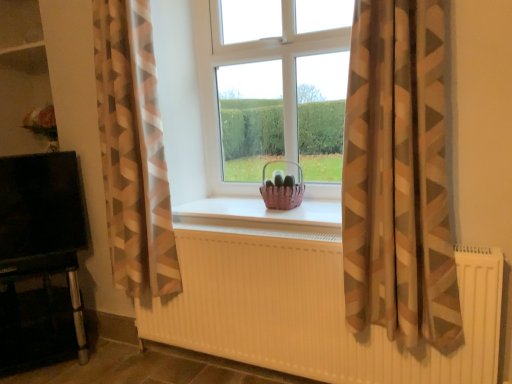
The height and width of the screenshot is (384, 512). Find the location of `white ribbed radiator at center`. white ribbed radiator at center is located at coordinates (310, 310).

At what (x,y) coordinates should I click in order to perform the action: click on black glossy tv at left. Please return your answer as a coordinate pair (x, y). Looking at the image, I should click on point(41,260).

Where is `pink woven basket at center`? Image resolution: width=512 pixels, height=384 pixels. pink woven basket at center is located at coordinates (283, 191).

This screenshot has height=384, width=512. Describe the element at coordinates (263, 211) in the screenshot. I see `pink woven basket at center` at that location.

The image size is (512, 384). Describe the element at coordinates (398, 177) in the screenshot. I see `brown sheer curtain at center, which is the 2th curtain in left-to-right order` at that location.

What is the approximate height of transparent glass window at center?

1.11 meters.

Describe the element at coordinates (273, 89) in the screenshot. Image resolution: width=512 pixels, height=384 pixels. I see `transparent glass window at center` at that location.

This screenshot has width=512, height=384. I want to click on white ribbed radiator at center, so click(310, 310).

In the scene shown: Which is behind, pink woven basket at center or white ribbed radiator at center?

pink woven basket at center is behind.

Image resolution: width=512 pixels, height=384 pixels. In the image, there is a pink woven basket at center. In order to click on radiator below it (from a real-world perspective) in this screenshot , I will do `click(310, 310)`.

Does pink woven basket at center turn towards white ribbed radiator at center?

Yes.

From a real-world perspective, is pink woven basket at center above or below pink woven basket at center?

Clearly, from a real-world perspective, pink woven basket at center is below pink woven basket at center.

Is pink woven basket at center completely or partially outside of pink woven basket at center?

Yes.

Consider the image. Which is less distant, (x=323, y=204) or (x=297, y=163)?

The point (x=323, y=204) is in front.

In the scene shown: Who is more distant, transparent glass window at center or pink woven basket at center?

transparent glass window at center is further from the camera.

From their relative heights in the image, would you say transparent glass window at center is taller or shorter than pink woven basket at center?

In the image, transparent glass window at center appears to be taller than pink woven basket at center.

Is transparent glass window at center to the right of pink woven basket at center from the viewer's perspective?

No, transparent glass window at center is not to the right of pink woven basket at center.

Considering the sizes of pink woven basket at center and transparent glass window at center in the image, is pink woven basket at center taller or shorter than transparent glass window at center?

Clearly, pink woven basket at center is shorter compared to transparent glass window at center.

Which object is further away from the camera taking this photo, pink woven basket at center or transparent glass window at center?

transparent glass window at center is further away from the camera.

From the image's perspective, does pink woven basket at center appear higher than transparent glass window at center?

No.

Does pink woven basket at center have a greater width compared to transparent glass window at center?

Yes, pink woven basket at center is wider than transparent glass window at center.

Considering the sizes of objects beige-patterned curtain at left, placed as the first curtain when sorted from left to right, and white ribbed radiator at center in the image provided, who is wider, beige-patterned curtain at left, placed as the first curtain when sorted from left to right, or white ribbed radiator at center?

beige-patterned curtain at left, placed as the first curtain when sorted from left to right.

From the image's perspective, who appears lower, beige-patterned curtain at left, placed as the first curtain when sorted from left to right, or white ribbed radiator at center?

white ribbed radiator at center appears lower in the image.

Is beige-patterned curtain at left, placed as the first curtain when sorted from left to right, facing towards white ribbed radiator at center?

No.

How much distance is there between beige-patterned curtain at left, placed as the first curtain when sorted from left to right, and white ribbed radiator at center?

beige-patterned curtain at left, placed as the first curtain when sorted from left to right, is 20.08 inches away from white ribbed radiator at center.

Does pink woven basket at center touch white ribbed radiator at center?

No, pink woven basket at center is not with white ribbed radiator at center.

Could white ribbed radiator at center be considered to be inside pink woven basket at center?

That's incorrect, white ribbed radiator at center is not inside pink woven basket at center.

Does point (269, 195) come behind point (219, 241)?

Yes, point (269, 195) is behind point (219, 241).

Based on the photo, is brown sheer curtain at center, which is the 2th curtain in left-to-right order, outside of transparent glass window at center?

Absolutely, brown sheer curtain at center, which is the 2th curtain in left-to-right order, is external to transparent glass window at center.

How many degrees apart are the facing directions of brown sheer curtain at center, which is the 2th curtain in left-to-right order, and transparent glass window at center?

The angular difference between brown sheer curtain at center, which is the 2th curtain in left-to-right order, and transparent glass window at center is 1.51 degrees.

Locate an element on the screen. The image size is (512, 384). window on the left of brown sheer curtain at center, positioned as the first curtain in right-to-left order is located at coordinates (273, 89).

Is brown sheer curtain at center, which is the 2th curtain in left-to-right order, taller or shorter than transparent glass window at center?

Considering their sizes, brown sheer curtain at center, which is the 2th curtain in left-to-right order, has more height than transparent glass window at center.

Identify the location of radiator below the pink woven basket at center (from the image's perspective). This screenshot has width=512, height=384. (310, 310).

Identify the location of basket above the pink woven basket at center (from the image's perspective). This screenshot has height=384, width=512. (283, 191).

Which object lies nearer to the anchor point white ribbed radiator at center, beige-patterned curtain at left, which is the 2th curtain from right to left, or pink woven basket at center?

The object closer to white ribbed radiator at center is beige-patterned curtain at left, which is the 2th curtain from right to left.

Based on their spatial positions, is pink woven basket at center or white ribbed radiator at center closer to transparent glass window at center?

Among the two, pink woven basket at center is located nearer to transparent glass window at center.

When comparing their distances from black glossy tv at left, does pink woven basket at center or white ribbed radiator at center seem further?

Based on the image, pink woven basket at center appears to be further to black glossy tv at left.

Looking at the image, which one is located closer to pink woven basket at center, white ribbed radiator at center or transparent glass window at center?

transparent glass window at center is closer to pink woven basket at center.

Based on their spatial positions, is transparent glass window at center or pink woven basket at center further from black glossy tv at left?

pink woven basket at center lies further to black glossy tv at left than the other object.

Estimate the real-world distances between objects in this image. Which object is further from pink woven basket at center, transparent glass window at center or black glossy tv at left?

black glossy tv at left is positioned further to the anchor pink woven basket at center.

Considering their positions, is black glossy tv at left positioned closer to brown sheer curtain at center, which is the 2th curtain in left-to-right order, than white ribbed radiator at center?

white ribbed radiator at center is closer to brown sheer curtain at center, which is the 2th curtain in left-to-right order.

Estimate the real-world distances between objects in this image. Which object is closer to black glossy tv at left, pink woven basket at center or brown sheer curtain at center, which is the 2th curtain in left-to-right order?

pink woven basket at center.

The height and width of the screenshot is (384, 512). I want to click on basket between transparent glass window at center and pink woven basket at center in the vertical direction, so click(x=283, y=191).

The width and height of the screenshot is (512, 384). I want to click on window sill positioned between brown sheer curtain at center, positioned as the first curtain in right-to-left order, and transparent glass window at center from near to far, so click(x=263, y=211).

Image resolution: width=512 pixels, height=384 pixels. I want to click on window between black glossy tv at left and brown sheer curtain at center, positioned as the first curtain in right-to-left order, from left to right, so 273,89.

This screenshot has height=384, width=512. Find the location of `window sill between black glossy tv at left and brown sheer curtain at center, positioned as the first curtain in right-to-left order, from left to right`. window sill between black glossy tv at left and brown sheer curtain at center, positioned as the first curtain in right-to-left order, from left to right is located at coordinates (263, 211).